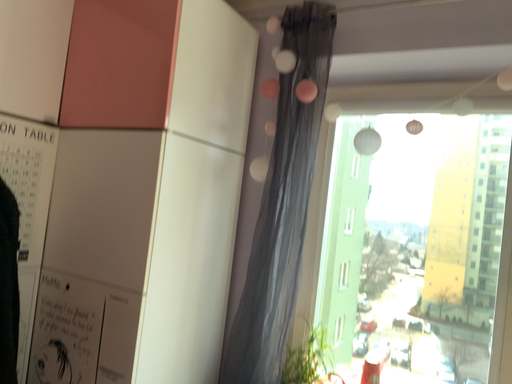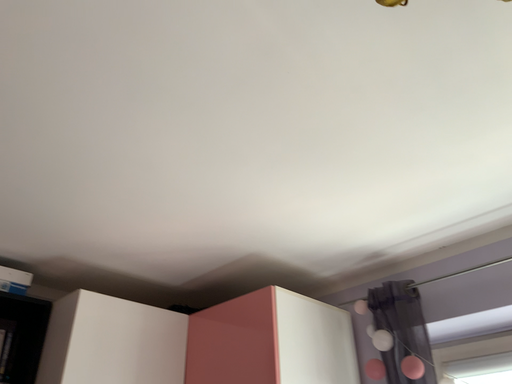
Question: Which way did the camera rotate in the video?

Choices:
 (A) rotated right
 (B) rotated left

Answer: (B)